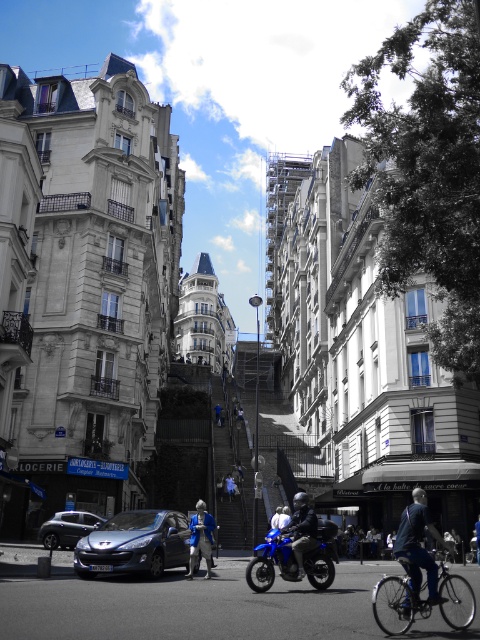
Question: Which object appears farthest from the camera in this image?

Choices:
 (A) blue matte bicycle at lower right
 (B) metallic blue hatchback at center
 (C) blue metallic motorcycle at center

Answer: (B)

Question: Which of the following is the farthest from the observer?

Choices:
 (A) (282, 557)
 (B) (205, 512)
 (C) (142, 516)
 (D) (103, 516)

Answer: (D)

Question: Can you confirm if metallic blue hatchback at center is positioned to the left of blue matte bicycle at lower right?

Choices:
 (A) no
 (B) yes

Answer: (B)

Question: Is metallic blue hatchback at center thinner than blue metallic motorcycle at center?

Choices:
 (A) no
 (B) yes

Answer: (A)

Question: Is metallic blue hatchback at center thinner than blue matte bicycle at lower right?

Choices:
 (A) yes
 (B) no

Answer: (B)

Question: Estimate the real-world distances between objects in this image. Which object is farther from the matte black car at lower left?

Choices:
 (A) blue fabric jacket at center
 (B) blue metallic motorcycle at center
 (C) blue matte bicycle at lower right
 (D) metallic blue hatchback at center

Answer: (C)